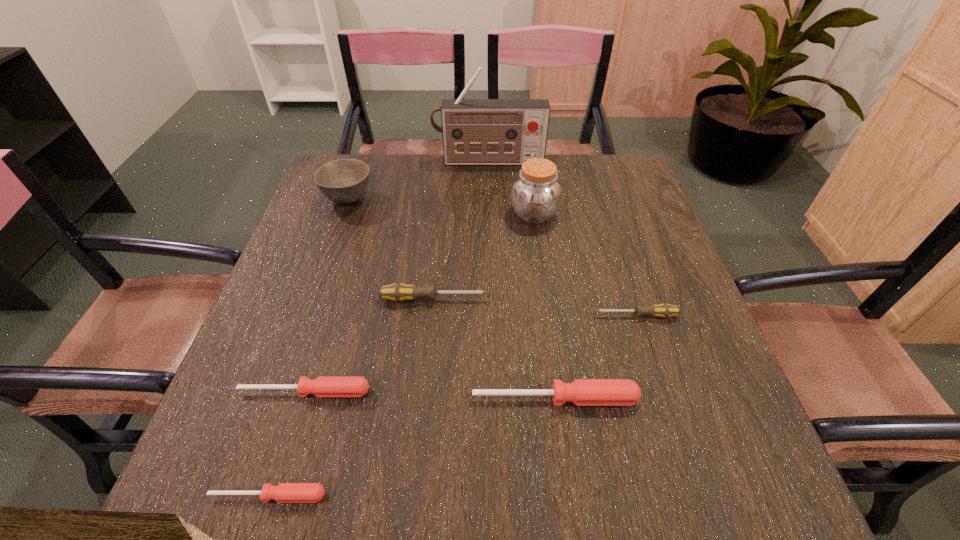
The width and height of the screenshot is (960, 540). In order to click on vacant region between the radio receiver and the rightmost red screwdriver in this screenshot , I will do `click(522, 280)`.

This screenshot has width=960, height=540. In order to click on vacant space in between the tallest object and the nearest red screwdriver in this screenshot , I will do `click(378, 328)`.

Where is `free point between the bigger gray screwdriver and the bowl`? free point between the bigger gray screwdriver and the bowl is located at coordinates (391, 248).

Identify the location of vacant space in between the fourth farthest object and the brown jar. This screenshot has width=960, height=540. (484, 256).

Where is `free space between the right gray screwdriver and the second biggest red screwdriver`? Image resolution: width=960 pixels, height=540 pixels. free space between the right gray screwdriver and the second biggest red screwdriver is located at coordinates (470, 354).

Locate an element on the screen. The image size is (960, 540). free point between the fourth nearest screwdriver and the nearest red screwdriver is located at coordinates (452, 406).

Where is `empty space that is in between the smallest red screwdriver and the rightmost red screwdriver`? empty space that is in between the smallest red screwdriver and the rightmost red screwdriver is located at coordinates (412, 447).

Identify the location of object that is the closest to the bowl. (475, 131).

This screenshot has height=540, width=960. I want to click on the fifth closest object to the rightmost red screwdriver, so click(x=536, y=194).

The height and width of the screenshot is (540, 960). Find the location of `the fourth closest screwdriver to the bigger gray screwdriver`. the fourth closest screwdriver to the bigger gray screwdriver is located at coordinates (284, 492).